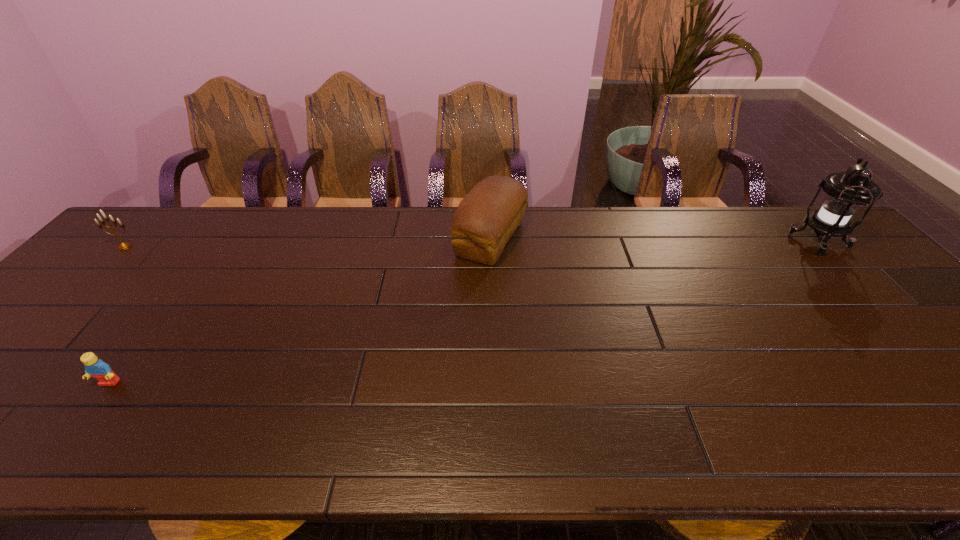
This screenshot has height=540, width=960. Identify the location of empty space between the bread and the candelabrum. (307, 243).

Identify which object is the third closest to the rightmost object. Please provide its 2D coordinates. Your answer should be formatted as a tuple, i.e. [(x, y)], where the tuple contains the x and y coordinates of a point satisfying the conditions above.

[(123, 246)]

Select which object appears as the third closest to the lantern. Please provide its 2D coordinates. Your answer should be formatted as a tuple, i.e. [(x, y)], where the tuple contains the x and y coordinates of a point satisfying the conditions above.

[(123, 246)]

Where is `free space that satisfies the following two spatial constraints: 1. on the back side of the leftmost object; 2. on the left side of the second object from right to left`? The height and width of the screenshot is (540, 960). free space that satisfies the following two spatial constraints: 1. on the back side of the leftmost object; 2. on the left side of the second object from right to left is located at coordinates (132, 239).

The image size is (960, 540). Identify the location of free point that satisfies the following two spatial constraints: 1. on the back side of the tallest object; 2. on the right side of the candelabrum. click(x=129, y=242).